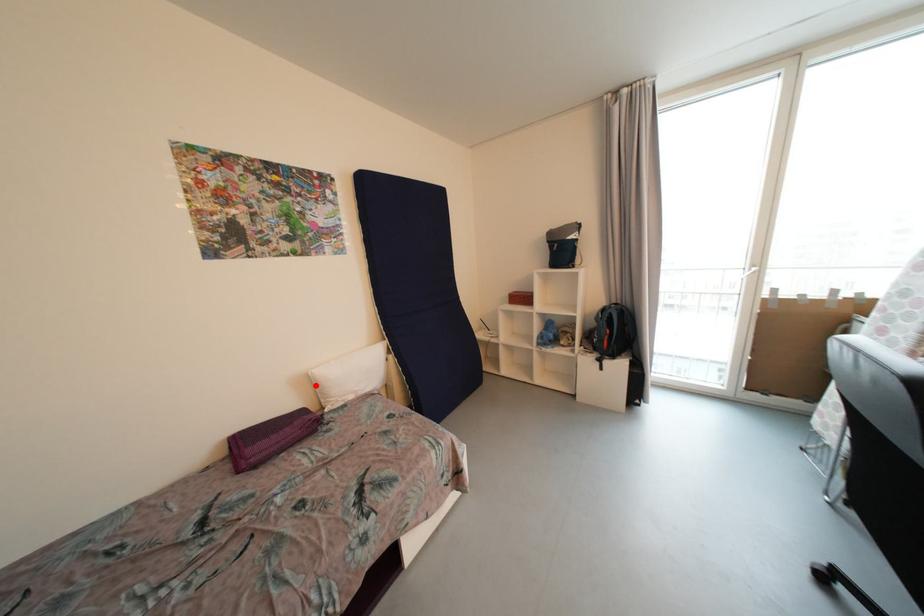
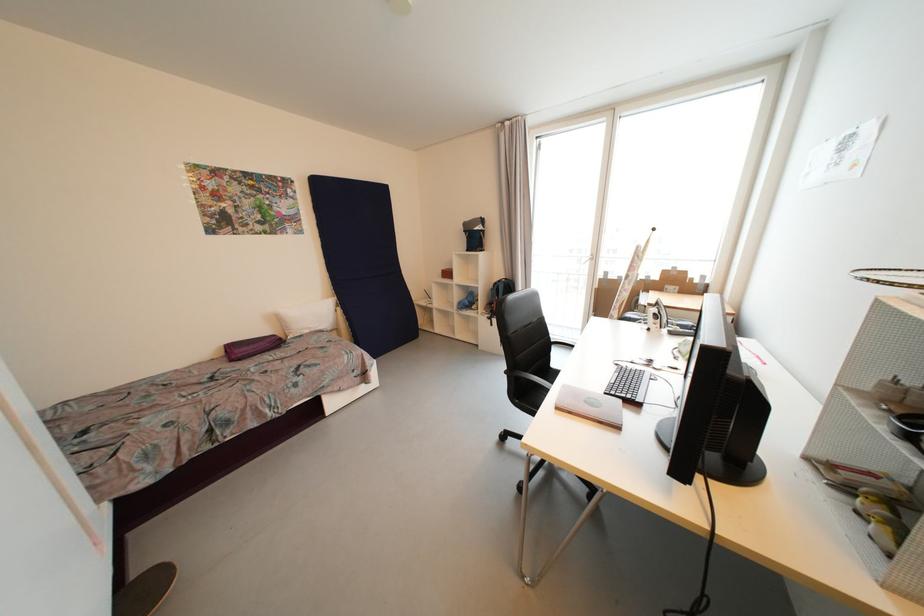
Question: I am providing you with two images of the same scene from different viewpoints. A red point is shown in image1. For the corresponding object point in image2, is it positioned nearer or farther from the camera?

Choices:
 (A) Nearer
 (B) Farther

Answer: (A)